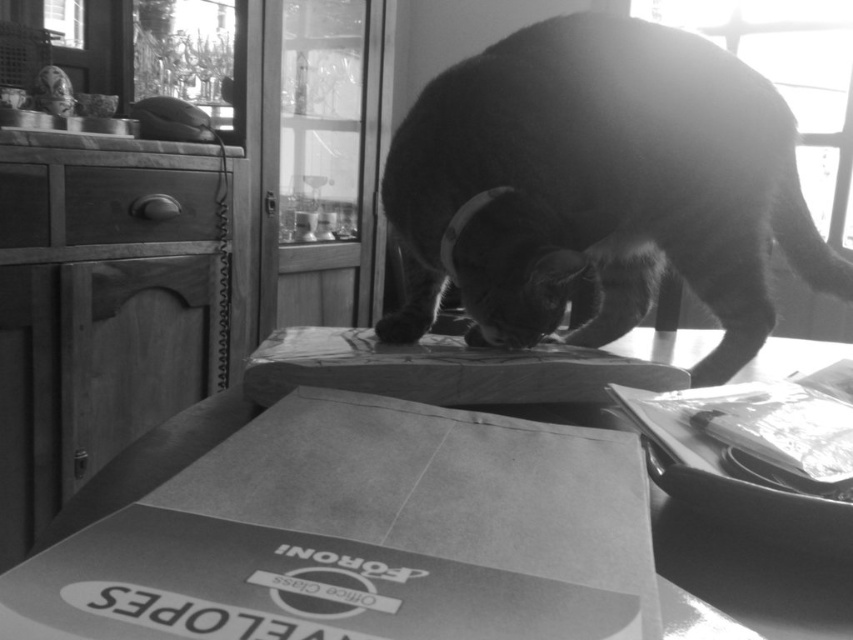
Which is above, smooth cardboard envelope at center or soft fur cat at center?

Positioned higher is soft fur cat at center.

Between smooth cardboard envelope at center and soft fur cat at center, which one has less height?

smooth cardboard envelope at center is shorter.

Is point (252, 419) closer to viewer compared to point (592, 180)?

Yes, point (252, 419) is in front of point (592, 180).

I want to click on smooth cardboard envelope at center, so point(364,534).

At what (x,y) coordinates should I click in order to perform the action: click on soft fur cat at center. Please return your answer as a coordinate pair (x, y). This screenshot has width=853, height=640. Looking at the image, I should click on [601, 186].

Which is more to the left, soft fur cat at center or cardboard box at center?

From the viewer's perspective, cardboard box at center appears more on the left side.

The image size is (853, 640). In order to click on soft fur cat at center in this screenshot , I will do `click(601, 186)`.

Does smooth cardboard envelope at center lie behind cardboard box at center?

That is False.

Is smooth cardboard envelope at center shorter than cardboard box at center?

Yes.

This screenshot has height=640, width=853. In order to click on smooth cardboard envelope at center in this screenshot , I will do `click(364, 534)`.